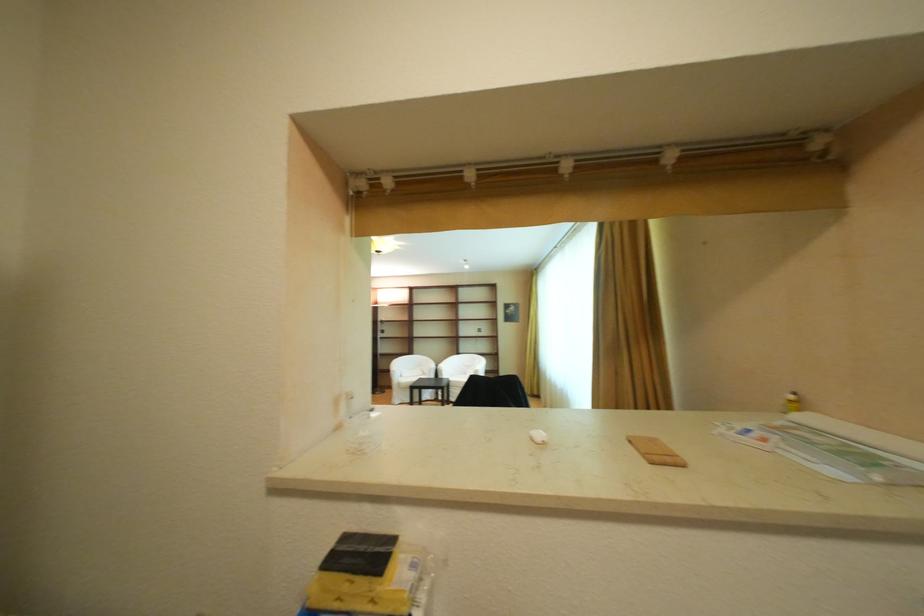
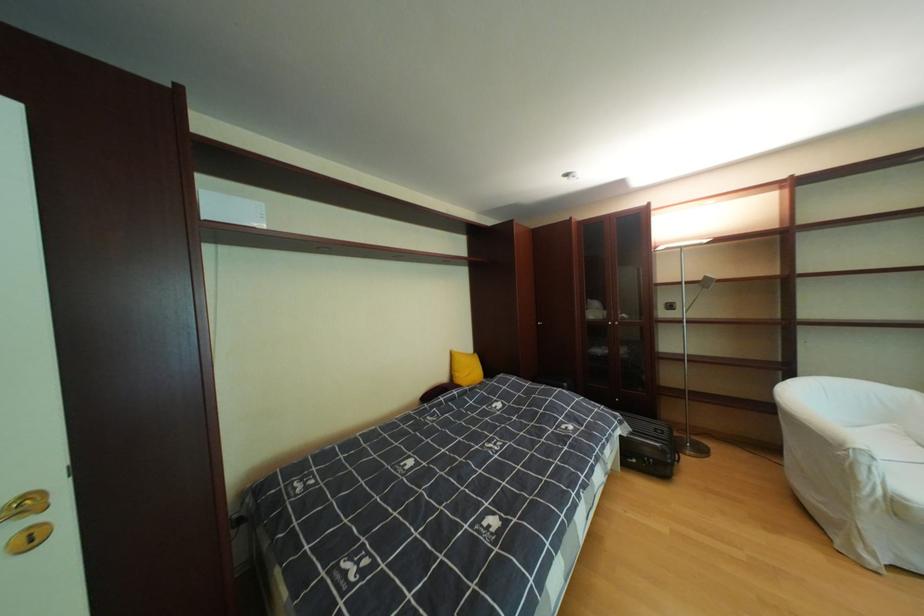
In the second image, find the point that corresponds to point (410, 385) in the first image.

(908, 506)